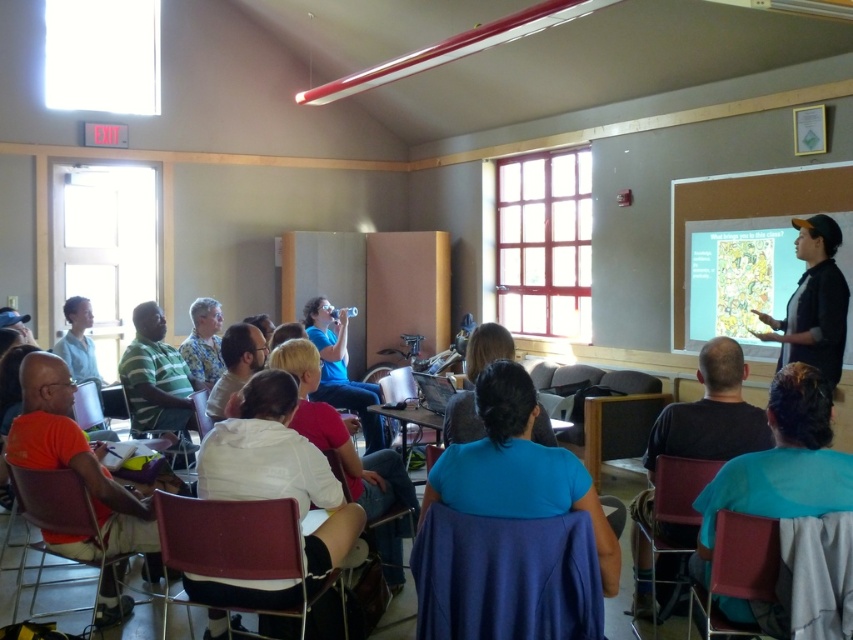
Question: Which point is farther to the camera?

Choices:
 (A) dark blue shirt at lower center
 (B) blue fabric shirt at lower right
 (C) matte blue shirt at center
 (D) green striped shirt at lower left

Answer: (C)

Question: Does blue fabric shirt at lower right have a larger size compared to black cap at upper right?

Choices:
 (A) no
 (B) yes

Answer: (A)

Question: Is dark blue shirt at lower center further to the viewer compared to matte blue shirt at center?

Choices:
 (A) yes
 (B) no

Answer: (B)

Question: Which object is positioned closest to the matte blue shirt at center?

Choices:
 (A) green striped shirt at lower left
 (B) blue fabric shirt at lower right
 (C) dark blue shirt at lower center

Answer: (A)

Question: Is orange matte shirt at lower left bigger than light blue shirt at lower left?

Choices:
 (A) yes
 (B) no

Answer: (A)

Question: Which point appears closest to the camera in this image?

Choices:
 (A) (367, 452)
 (B) (796, 323)
 (C) (102, 529)
 (D) (141, 349)

Answer: (C)